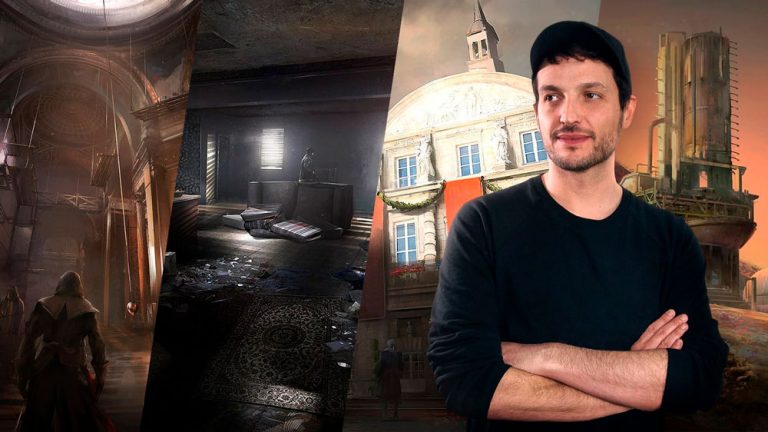
Find the location of a particular element. This screenshot has width=768, height=432. windows is located at coordinates (408, 245), (415, 173), (468, 162), (535, 146), (276, 155).